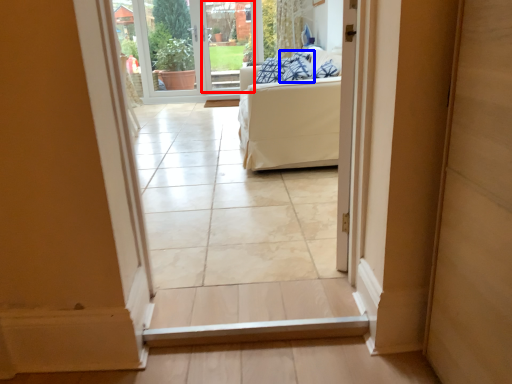
Question: Which of the following is the farthest to the observer, glass door (highlighted by a red box) or pillow (highlighted by a blue box)?

Choices:
 (A) glass door
 (B) pillow

Answer: (A)